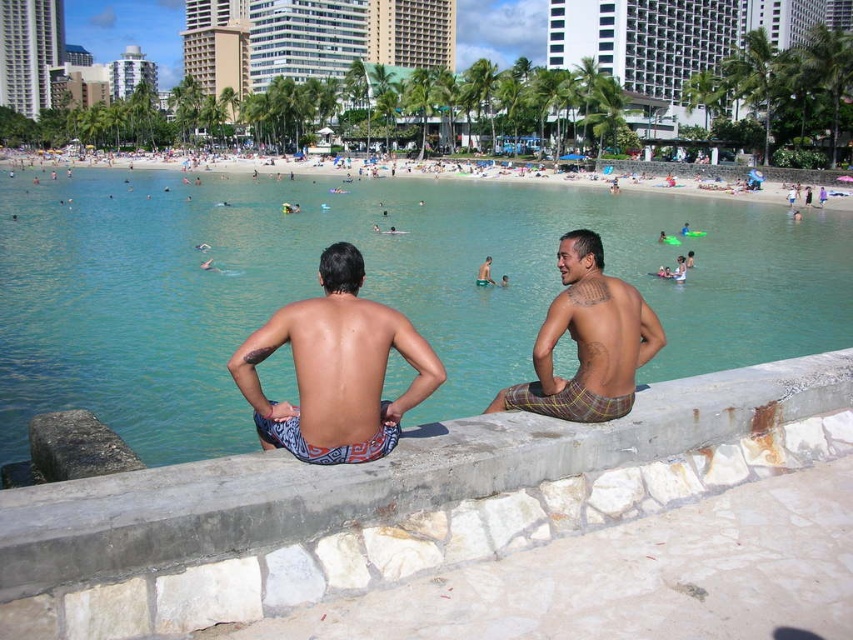
What do you see at coordinates (587, 340) in the screenshot?
I see `brown plaid shorts at center` at bounding box center [587, 340].

Does brown plaid shorts at center appear on the left side of smooth tan skin at center?

Incorrect, brown plaid shorts at center is not on the left side of smooth tan skin at center.

Does point (541, 404) come behind point (482, 264)?

That is False.

Find the location of a particular element. Image resolution: width=853 pixels, height=640 pixels. brown plaid shorts at center is located at coordinates (587, 340).

Can you confirm if clear blue water at center is bigger than brown plaid shorts at center?

Correct, clear blue water at center is larger in size than brown plaid shorts at center.

Can you confirm if clear blue water at center is wider than brown plaid shorts at center?

Indeed, clear blue water at center has a greater width compared to brown plaid shorts at center.

Between point (258, 209) and point (544, 412), which one is positioned in front?

Point (544, 412)

I want to click on clear blue water at center, so click(363, 288).

Is concrete at center above blue patterned shorts at center?

Actually, concrete at center is below blue patterned shorts at center.

Does concrete at center appear on the left side of blue patterned shorts at center?

In fact, concrete at center is to the right of blue patterned shorts at center.

Does point (125, 541) come farther from viewer compared to point (257, 328)?

No.

What are the coordinates of `concrete at center` in the screenshot? It's located at (379, 476).